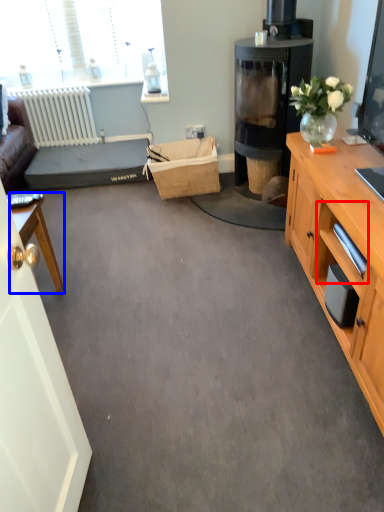
Question: Which of the following is the closest to the observer, drawer (highlighted by a red box) or desk (highlighted by a blue box)?

Choices:
 (A) drawer
 (B) desk

Answer: (A)